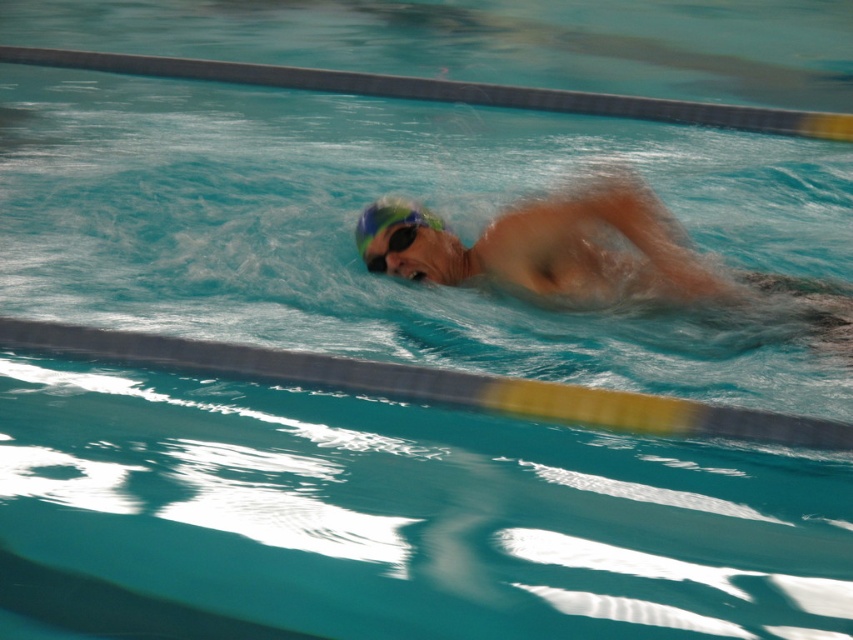
You are standing at the edge of the pool and see the matte green swim cap at center. If you want to throw a lifebuoy to reach the swimmer, will it be within a 15 feet range?

The distance between the matte green swim cap at center and the viewer is 12.76 feet, which is within the 15 feet range. Therefore, the lifebuoy can reach the swimmer.

You are a lifeguard observing the pool and notice two swim caps at the center of the pool. Which one is taller between the matte green swim cap at center and the blue matte swim cap at center?

The matte green swim cap at center is taller than the blue matte swim cap at center.